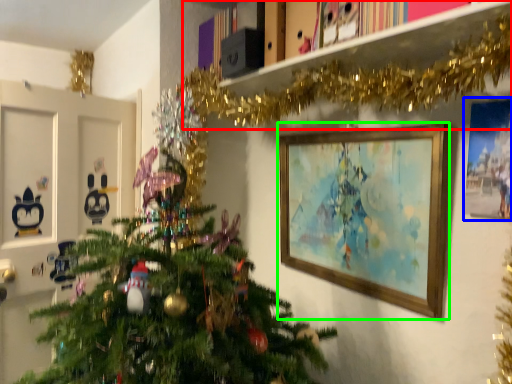
Question: Based on their relative distances, which object is nearer to bookshelf (highlighted by a red box)? Choose from picture frame (highlighted by a blue box) and picture frame (highlighted by a green box).

Choices:
 (A) picture frame
 (B) picture frame

Answer: (B)